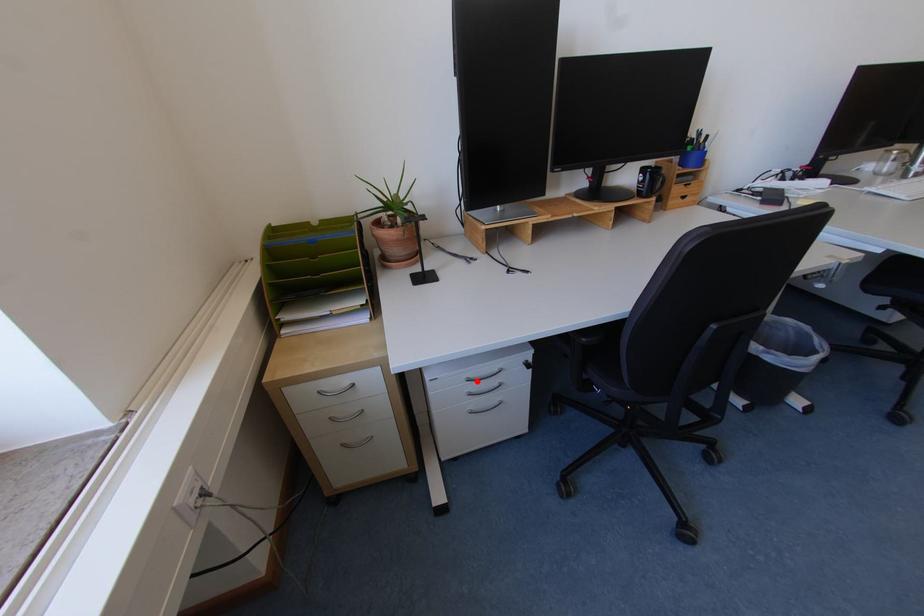
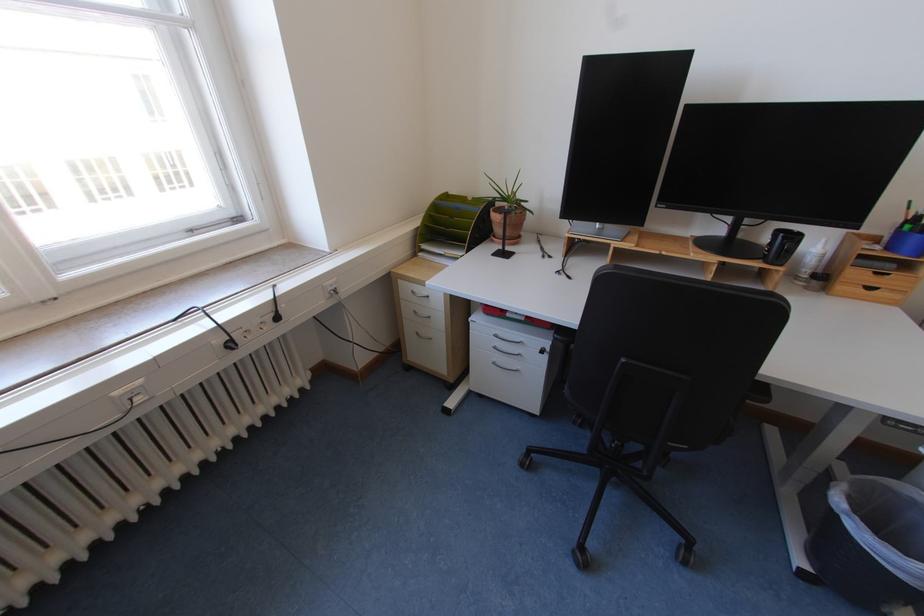
In the second image, find the point that corresponds to the highlighted location in the first image.

(504, 337)